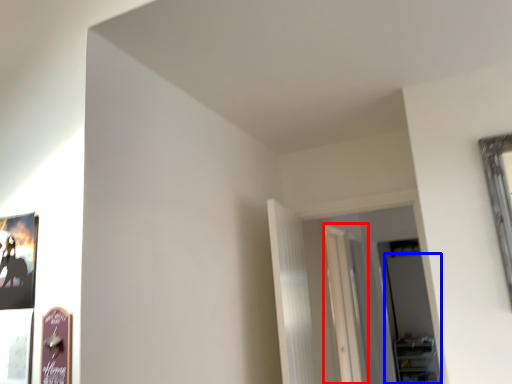
Question: Which of the following is the closest to the observer, glass door (highlighted by a red box) or glass door (highlighted by a blue box)?

Choices:
 (A) glass door
 (B) glass door

Answer: (A)